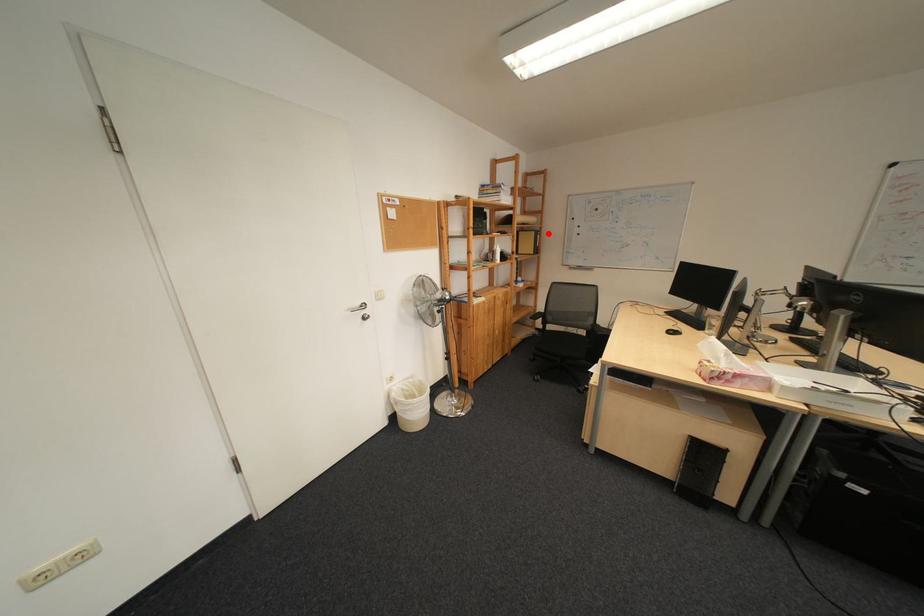
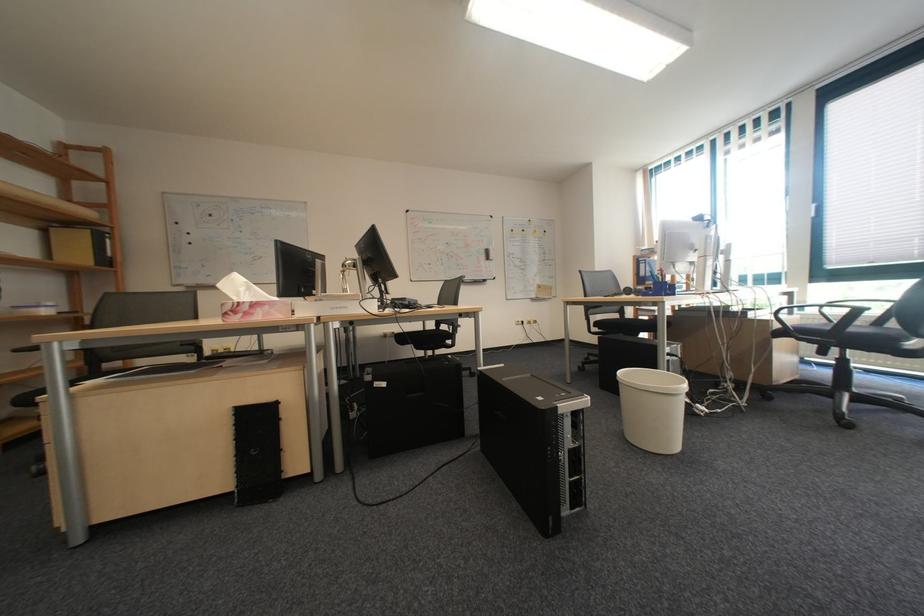
Question: I am providing you with two images of the same scene from different viewpoints. Given a red point in image1, look at the same physical point in image2. Is it:

Choices:
 (A) Closer to the viewpoint
 (B) Farther from the viewpoint

Answer: (B)